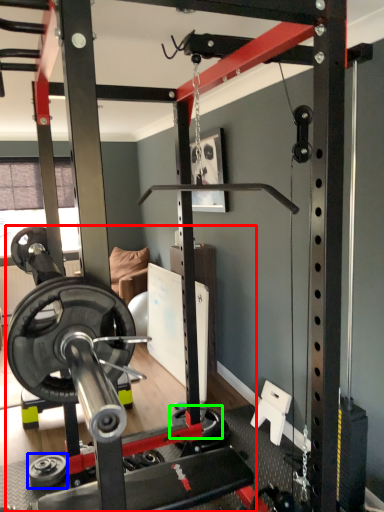
Question: Which object is positioned farthest from barbell (highlighted by a red box)? Select from wheel (highlighted by a blue box) and wheel (highlighted by a green box).

Choices:
 (A) wheel
 (B) wheel

Answer: (A)